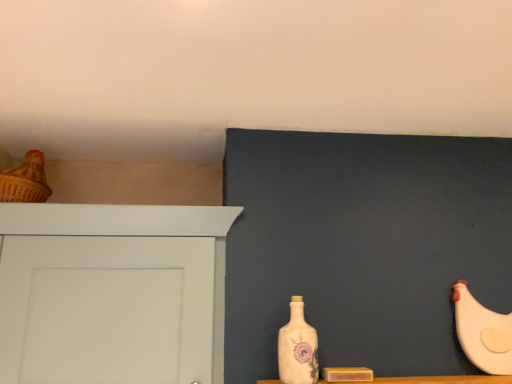
Question: From a real-world perspective, is porcelain floral bottle at center physically located above or below white painted wood door at left?

Choices:
 (A) below
 (B) above

Answer: (A)

Question: Is porcelain floral bottle at center inside or outside of white painted wood door at left?

Choices:
 (A) outside
 (B) inside

Answer: (A)

Question: Which object is the farthest from the porcelain floral bottle at center?

Choices:
 (A) white painted wood door at left
 (B) matte brown chicken at upper left, which appears as the 1th chicken when viewed from the top
 (C) white matte chicken at right, which is the 1th chicken in right-to-left order

Answer: (B)

Question: Estimate the real-world distances between objects in this image. Which object is farther from the porcelain floral bottle at center?

Choices:
 (A) white matte chicken at right, which is the 1th chicken in right-to-left order
 (B) matte brown chicken at upper left, arranged as the 2th chicken when viewed from the right
 (C) white painted wood door at left

Answer: (B)